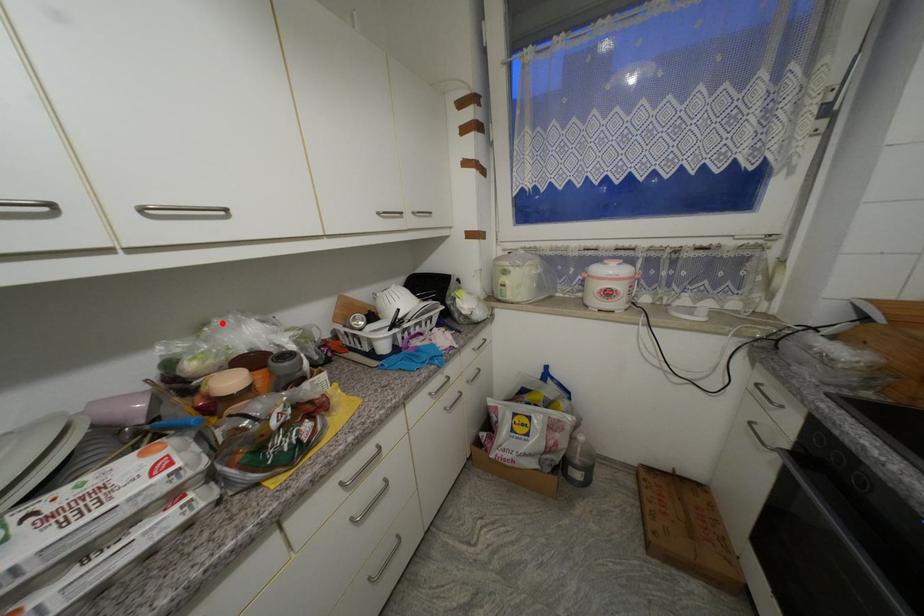
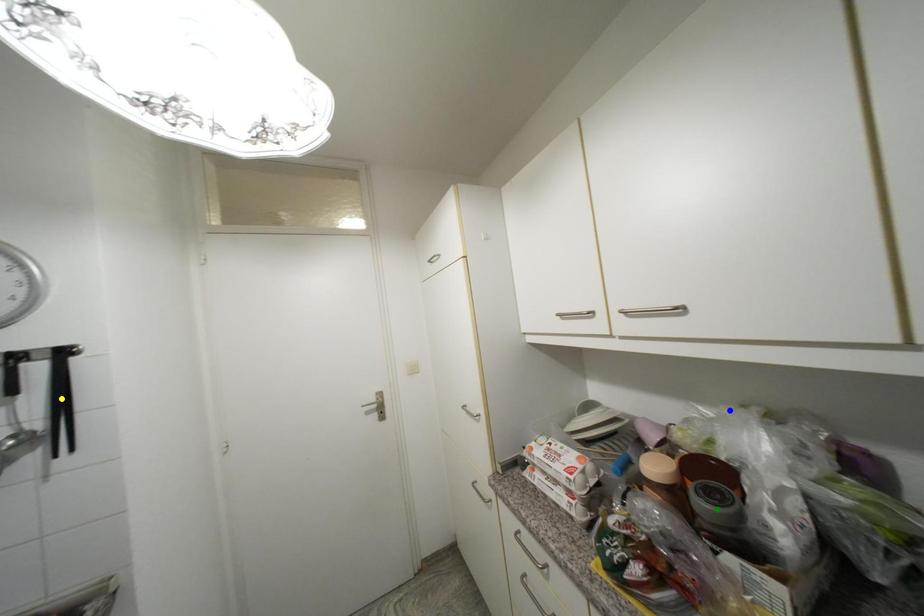
Question: I am providing you with two images of the same scene from different viewpoints. A red point is marked on the first image. You are given multiple points on the second image. Can you choose the point in image 2 that corresponds to the point in image 1?

Choices:
 (A) yellow point
 (B) blue point
 (C) green point

Answer: (B)